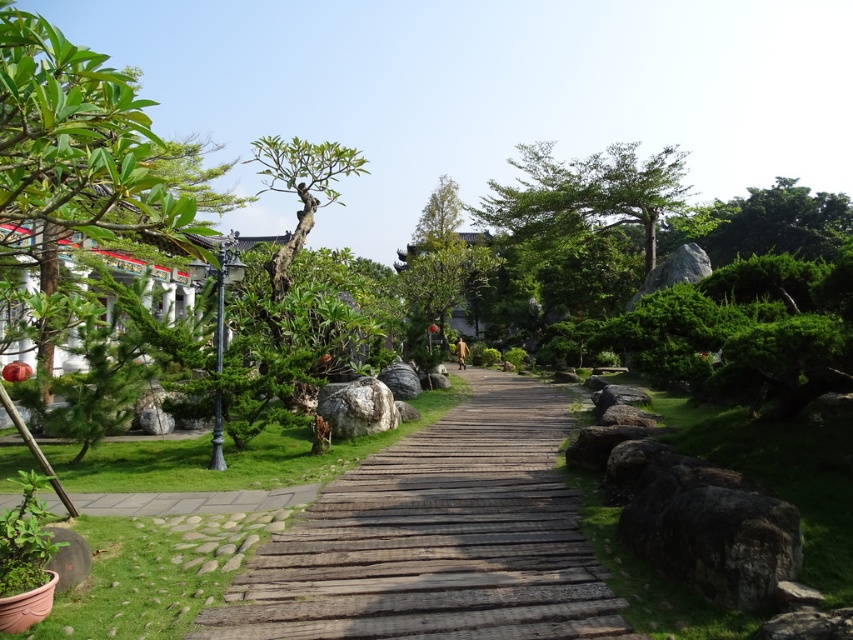
Between weathered wood path at center and green leafy tree at left, which one has more height?

green leafy tree at left

Which is behind, point (339, 627) or point (73, 195)?

The point (339, 627) is more distant.

Identify the location of weathered wood path at center. This screenshot has height=640, width=853. (436, 540).

Does gray rough rock at center come in front of gray polished stone at center?

Yes, it is in front of gray polished stone at center.

Who is more distant from viewer, [370,387] or [404,381]?

The point [404,381] is more distant.

Which is behind, point (326, 408) or point (380, 371)?

The point (380, 371) is more distant.

Locate an element on the screen. Image resolution: width=853 pixels, height=640 pixels. gray rough rock at center is located at coordinates (357, 406).

Can you confirm if gray rough rock at lower right is shorter than gray rough stone at left?

No.

Between point (747, 518) and point (167, 413), which one is positioned behind?

Positioned behind is point (167, 413).

The width and height of the screenshot is (853, 640). What are the coordinates of `gray rough rock at lower right` in the screenshot? It's located at (714, 534).